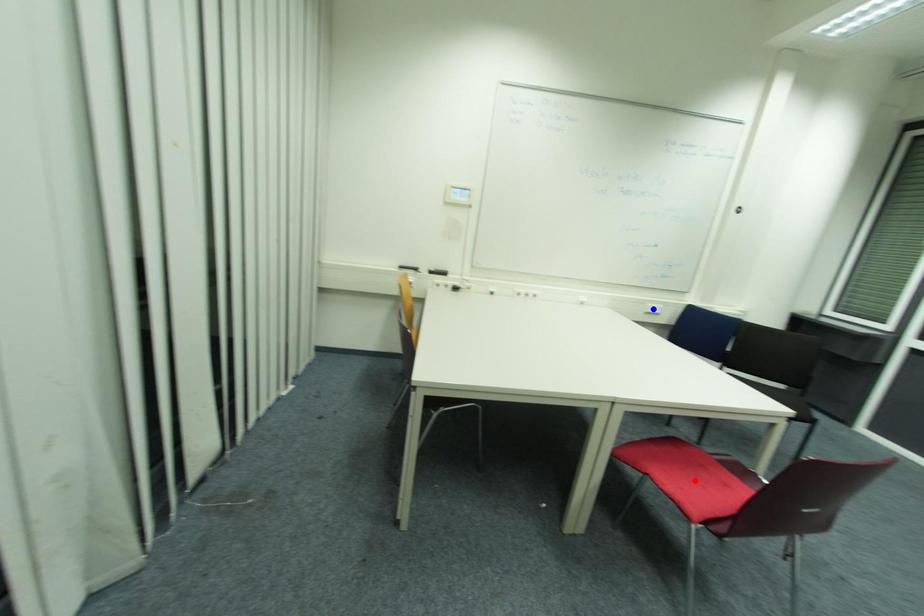
Question: Two points are marked on the image. Which point is closer to the camera?

Choices:
 (A) Blue point is closer.
 (B) Red point is closer.

Answer: (B)